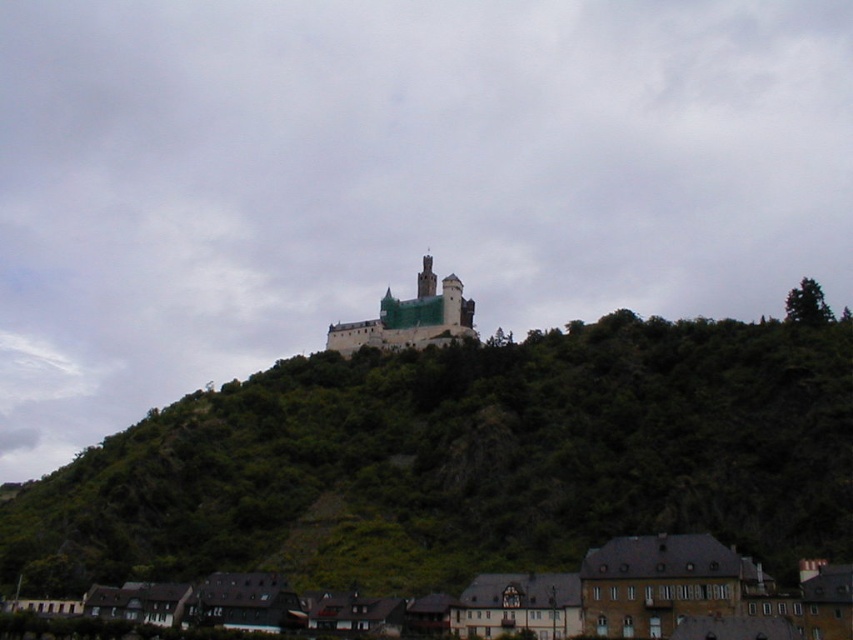
You are a hiker who wants to reach the stone medieval castle at center from the green leafy hillside at center. Given that your average walking speed is 1.5 meters per second, how long will it take you to walk directly to the castle?

→ The distance between the green leafy hillside at center and the stone medieval castle at center is 37.99 meters. At a speed of 1.5 meters per second, the time required would be approximately 25.33 seconds.

You are a landscape architect planning to plant new trees on the green leafy hillside at center and the stone medieval castle at center. Which area has more space available for planting new trees?

The green leafy hillside at center has more space available for planting new trees since it is larger in size than the stone medieval castle at center.

You are standing at the base of the hill and want to reach the castle on top. The green leafy hillside at center is in your way. Can you walk directly towards the castle from your current position?

The green leafy hillside at center is located at point (x=468, y=460), which is directly in the path towards the castle. Therefore, you would need to navigate around it to reach the castle.